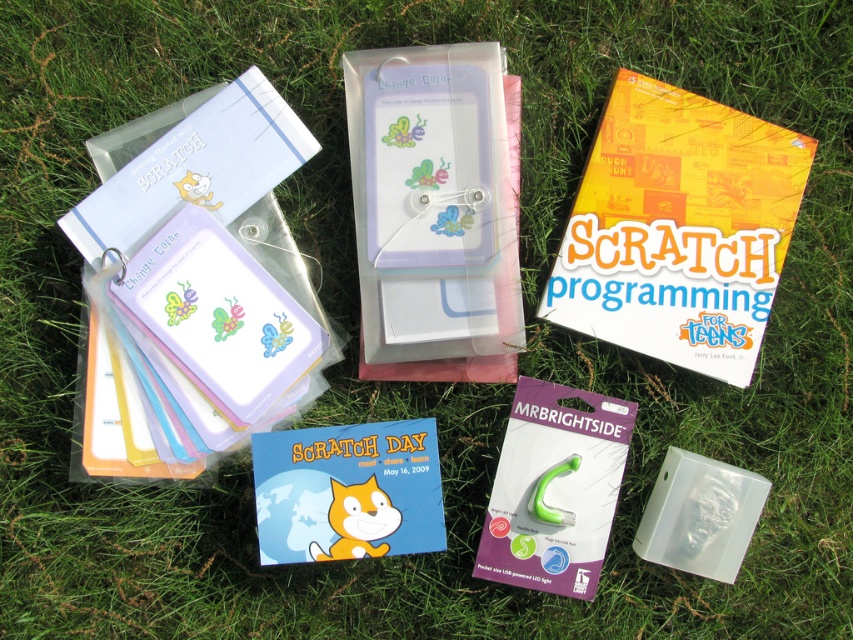
Question: Which point appears closest to the camera in this image?

Choices:
 (A) (352, 493)
 (B) (372, 76)

Answer: (A)

Question: Which object is the closest to the pastel plastic cards at upper left?

Choices:
 (A) transparent plastic case at center
 (B) matte plastic card at center
 (C) green plastic mrbrightside at center

Answer: (B)

Question: Does matte plastic card at center appear over green plastic mrbrightside at center?

Choices:
 (A) no
 (B) yes

Answer: (B)

Question: Can you confirm if transparent plastic case at center is positioned to the right of matte yellow cat at center?

Choices:
 (A) yes
 (B) no

Answer: (A)

Question: Which point is closer to the camera?

Choices:
 (A) (100, 304)
 (B) (703, 534)

Answer: (A)

Question: Is pastel plastic cards at upper left positioned at the back of green plastic mrbrightside at center?

Choices:
 (A) yes
 (B) no

Answer: (B)